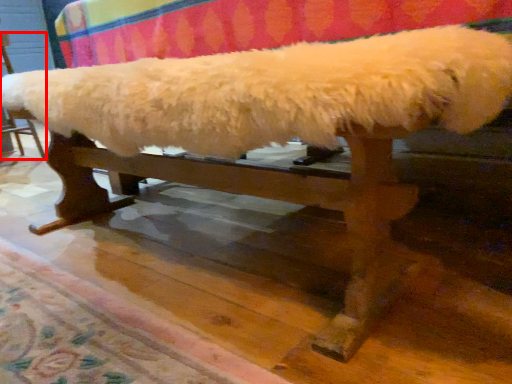
Question: In this image, where is furniture (annotated by the red box) located relative to mat?

Choices:
 (A) left
 (B) right

Answer: (A)